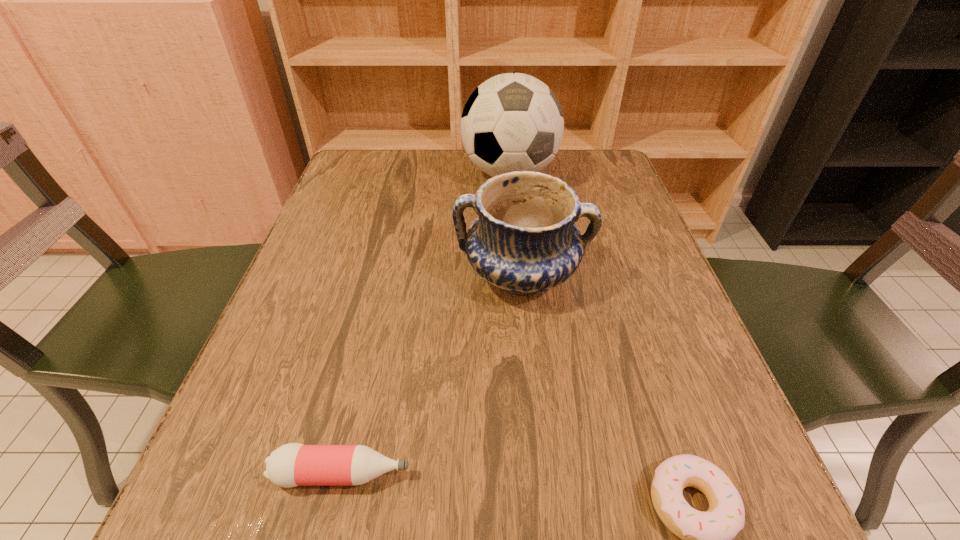
Choose which object is the second nearest neighbor to the shortest object. Please provide its 2D coordinates. Your answer should be formatted as a tuple, i.e. [(x, y)], where the tuple contains the x and y coordinates of a point satisfying the conditions above.

[(294, 464)]

Image resolution: width=960 pixels, height=540 pixels. Find the location of `object identified as the third closest to the farthest object`. object identified as the third closest to the farthest object is located at coordinates (707, 536).

The width and height of the screenshot is (960, 540). What are the coordinates of `free space that satisfies the following two spatial constraints: 1. on the main logo of the tallest object; 2. with the cap open on the second shortest object` in the screenshot? It's located at (539, 474).

You are a GUI agent. You are given a task and a screenshot of the screen. Output one action in this format:
    pyautogui.click(x=<x>, y=<y>)
    Task: Click on the free space in the image that satisfies the following two spatial constraints: 1. on the main logo of the farthest object; 2. with the cap open on the bottle
    This screenshot has width=960, height=540.
    Given the screenshot: What is the action you would take?
    pyautogui.click(x=539, y=474)

This screenshot has width=960, height=540. I want to click on free location that satisfies the following two spatial constraints: 1. on the main logo of the farthest object; 2. on the right side of the pottery, so click(519, 275).

Locate an element on the screen. free space that satisfies the following two spatial constraints: 1. on the main logo of the farthest object; 2. on the right side of the third shortest object is located at coordinates (519, 275).

The image size is (960, 540). Identify the location of free space that satisfies the following two spatial constraints: 1. on the main logo of the third shortest object; 2. on the right side of the farthest object. (519, 275).